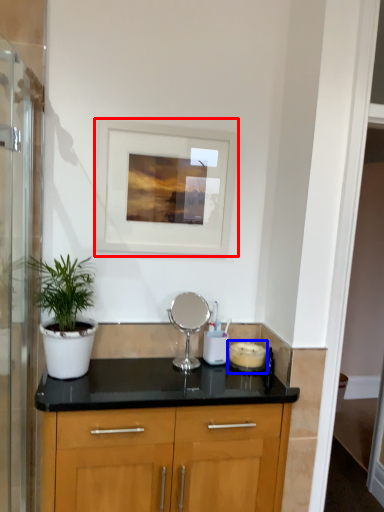
Question: Which point is closer to the camera, picture frame (highlighted by a red box) or appliance (highlighted by a blue box)?

Choices:
 (A) picture frame
 (B) appliance

Answer: (A)